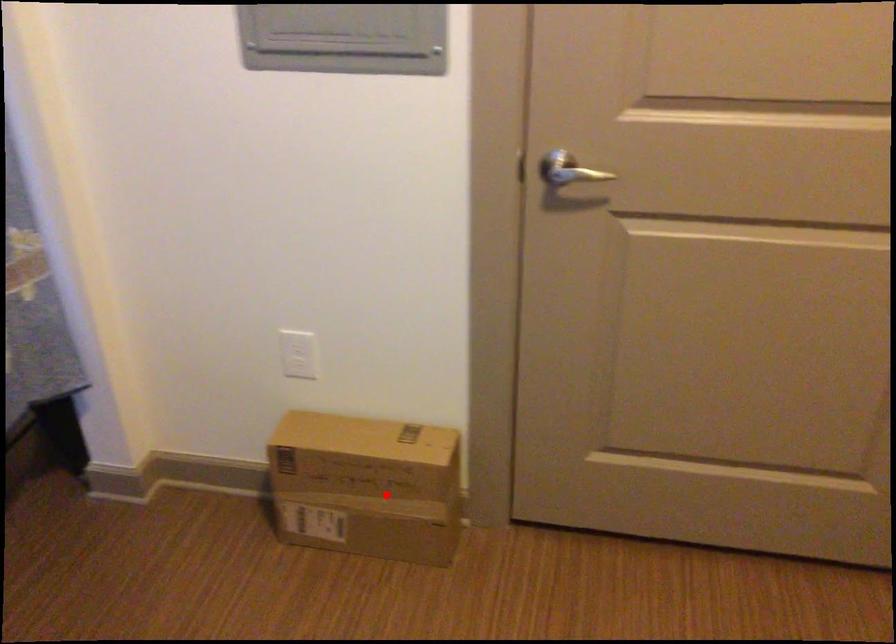
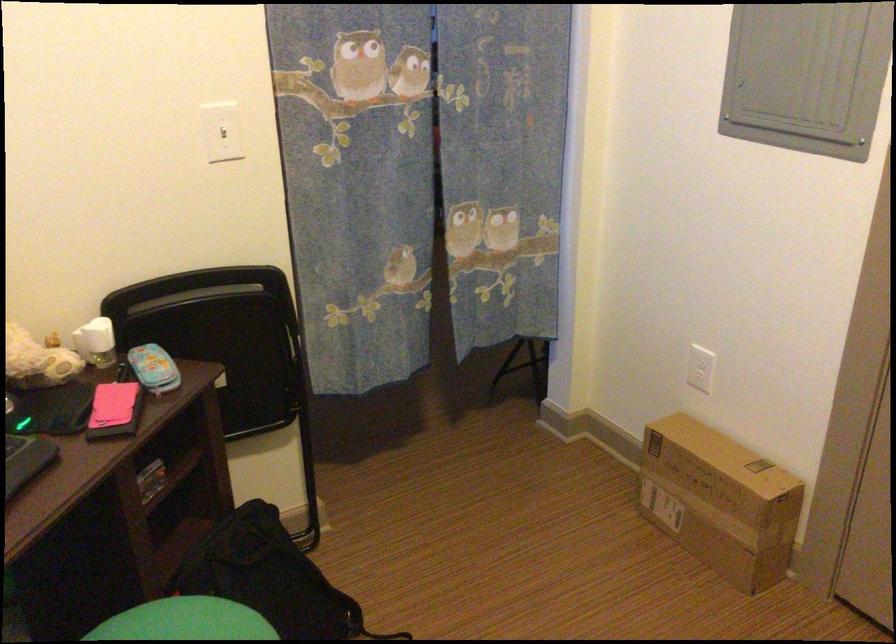
Find the pixel in the second image that matches the highlighted location in the first image.

(719, 500)